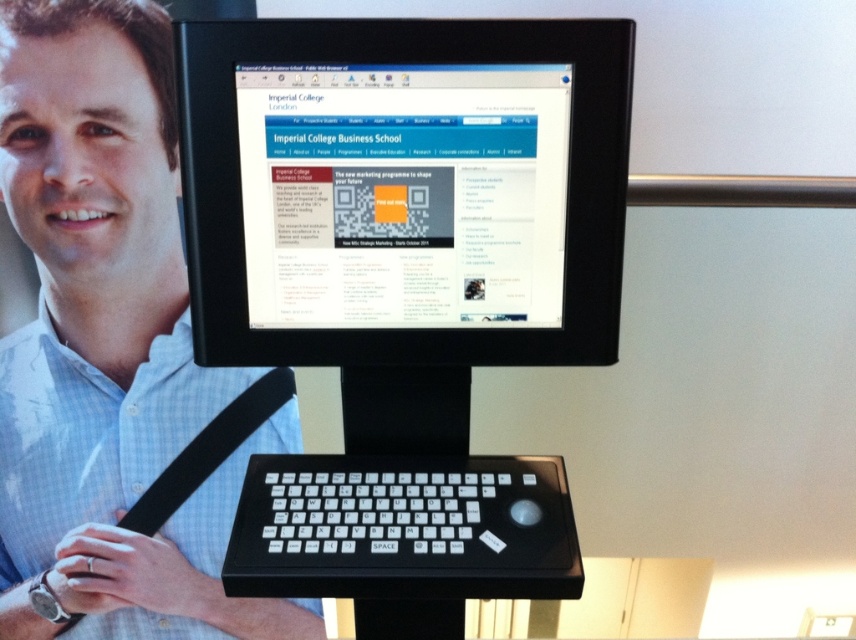
You are setting up a new computer desk and need to place both the matte black keyboard at lower center and the black plastic keyboard at center. If you want to arrange them side by side horizontally, which one should be placed first to ensure they fit properly?

The matte black keyboard at lower center is wider than the black plastic keyboard at center, so you should place the matte black keyboard at lower center first to accommodate its width when arranging them side by side horizontally.

You are setting up a new computer desk and need to place both the matte black keyboard at lower center and the black plastic keyboard at center. According to the image, which keyboard should be placed higher on the desk?

The matte black keyboard at lower center should be placed higher because it is positioned above the black plastic keyboard at center in the image.

You are setting up a new computer desk and want to place the black plastic monitor at center and the matte black keyboard at lower center in a way that follows the original image. Which object should be placed to the right of the other?

The black plastic monitor at center is positioned on the right side of matte black keyboard at lower center, so the monitor should be placed to the right of the keyboard.